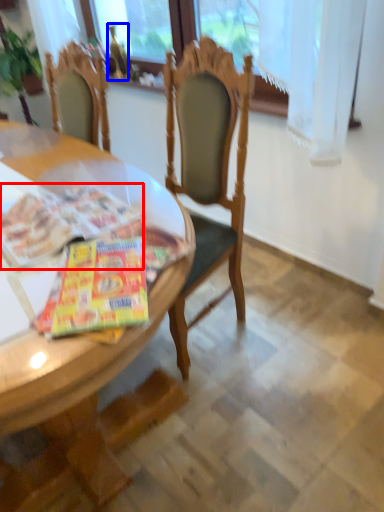
Question: Which object appears farthest to the camera in this image, magazine (highlighted by a red box) or bottle (highlighted by a blue box)?

Choices:
 (A) magazine
 (B) bottle

Answer: (B)